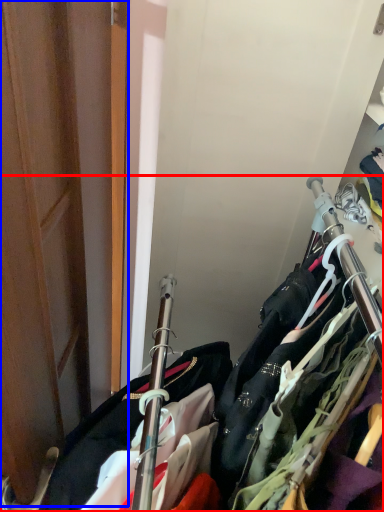
Question: Among these objects, which one is nearest to the camera, closet (highlighted by a red box) or door (highlighted by a blue box)?

Choices:
 (A) closet
 (B) door

Answer: (B)